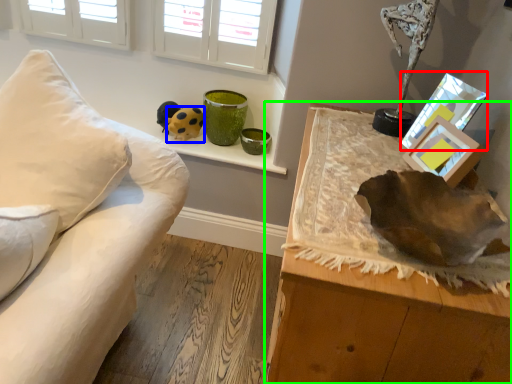
Question: Considering the real-world distances, which object is farthest from picture frame (highlighted by a red box)? toy (highlighted by a blue box) or table (highlighted by a green box)?

Choices:
 (A) toy
 (B) table

Answer: (A)